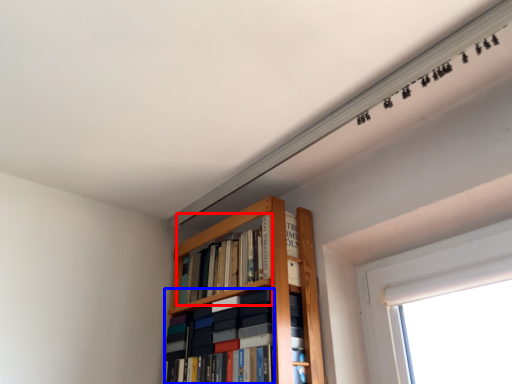
Question: Which of the following is the closest to the observer, book (highlighted by a red box) or book (highlighted by a blue box)?

Choices:
 (A) book
 (B) book

Answer: (B)